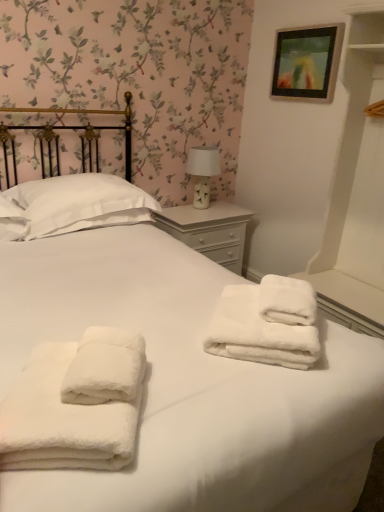
Question: Can you confirm if wooden picture frame at upper right is bigger than white fluffy towels at center, marked as the 2th towel in a front-to-back arrangement?

Choices:
 (A) yes
 (B) no

Answer: (B)

Question: Could you tell me if wooden picture frame at upper right is turned towards white fluffy towels at center, acting as the first towel starting from the right?

Choices:
 (A) no
 (B) yes

Answer: (A)

Question: Can you confirm if wooden picture frame at upper right is smaller than white fluffy towels at center, marked as the 2th towel in a front-to-back arrangement?

Choices:
 (A) no
 (B) yes

Answer: (B)

Question: Can you confirm if wooden picture frame at upper right is taller than white fluffy towels at center, arranged as the 2th towel when viewed from the left?

Choices:
 (A) yes
 (B) no

Answer: (A)

Question: Would you say white fluffy towels at center, marked as the 2th towel in a front-to-back arrangement, is part of wooden picture frame at upper right's contents?

Choices:
 (A) yes
 (B) no

Answer: (B)

Question: From a real-world perspective, is wooden picture frame at upper right beneath white fluffy towels at center, marked as the 2th towel in a front-to-back arrangement?

Choices:
 (A) no
 (B) yes

Answer: (A)

Question: Is the position of white fluffy towels at center, the 1th towel when ordered from front to back, more distant than that of wooden picture frame at upper right?

Choices:
 (A) yes
 (B) no

Answer: (B)

Question: Is white fluffy towels at center, which appears as the first towel when viewed from the left, positioned in front of wooden picture frame at upper right?

Choices:
 (A) no
 (B) yes

Answer: (B)

Question: From the image's perspective, is white fluffy towels at center, which appears as the first towel when viewed from the left, located beneath wooden picture frame at upper right?

Choices:
 (A) yes
 (B) no

Answer: (A)

Question: Can you confirm if white fluffy towels at center, acting as the 2th towel starting from the right, is positioned to the left of wooden picture frame at upper right?

Choices:
 (A) no
 (B) yes

Answer: (B)

Question: Is white fluffy towels at center, the 1th towel when ordered from front to back, beside wooden picture frame at upper right?

Choices:
 (A) yes
 (B) no

Answer: (B)

Question: Is white fluffy towels at center, acting as the 2th towel starting from the back, far from wooden picture frame at upper right?

Choices:
 (A) yes
 (B) no

Answer: (A)

Question: Would you say white soft pillow at upper left is a long distance from white painted wood nightstand at center?

Choices:
 (A) no
 (B) yes

Answer: (A)